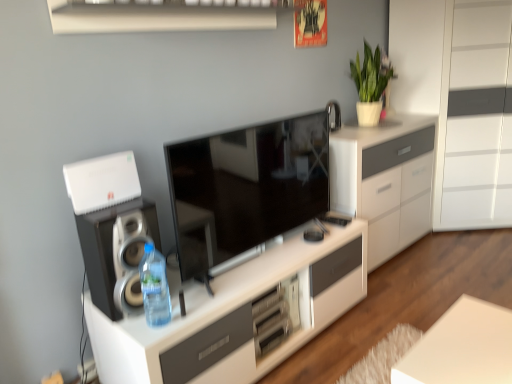
Image resolution: width=512 pixels, height=384 pixels. What are the coordinates of `white plastic router at upper left` in the screenshot? It's located at (102, 182).

The height and width of the screenshot is (384, 512). What do you see at coordinates (102, 182) in the screenshot?
I see `white plastic router at upper left` at bounding box center [102, 182].

Measure the distance between white glossy cabinet at right and camera.

A distance of 9.11 feet exists between white glossy cabinet at right and camera.

Where is `matte black speaker at left`? The width and height of the screenshot is (512, 384). matte black speaker at left is located at coordinates (117, 253).

Measure the distance between white matte plant at upper right and camera.

A distance of 2.74 meters exists between white matte plant at upper right and camera.

In order to face white glossy cabinet at center, placed as the second cabinetry when sorted from bottom to top, should I rotate leftwards or rightwards?

You should look right and rotate roughly 15.387 degrees.

Measure the distance between point (x=191, y=17) and camera.

Point (x=191, y=17) is 6.52 feet from camera.

The width and height of the screenshot is (512, 384). I want to click on white plastic router at upper left, so click(102, 182).

Can you confirm if translucent plastic bottle at lower left is positioned to the left of white glossy cabinet at center, placed as the 2th cabinetry when sorted from top to bottom?

Correct, you'll find translucent plastic bottle at lower left to the left of white glossy cabinet at center, placed as the 2th cabinetry when sorted from top to bottom.

How far apart are translucent plastic bottle at lower left and white glossy cabinet at center, which appears as the first cabinetry when ordered from the bottom?

16.52 inches.

Locate an element on the screen. bottle located above the white glossy cabinet at center, placed as the 2th cabinetry when sorted from top to bottom (from the image's perspective) is located at coordinates (154, 287).

Can you see white glossy cabinet at center, placed as the second cabinetry when sorted from bottom to top, touching translucent plastic bottle at lower left?

No, white glossy cabinet at center, placed as the second cabinetry when sorted from bottom to top, is not beside translucent plastic bottle at lower left.

Considering the relative sizes of white glossy cabinet at center, placed as the second cabinetry when sorted from bottom to top, and translucent plastic bottle at lower left in the image provided, is white glossy cabinet at center, placed as the second cabinetry when sorted from bottom to top, bigger than translucent plastic bottle at lower left?

Yes, white glossy cabinet at center, placed as the second cabinetry when sorted from bottom to top, is bigger than translucent plastic bottle at lower left.

Is white glossy cabinet at center, placed as the second cabinetry when sorted from bottom to top, to the left or to the right of translucent plastic bottle at lower left in the image?

In the image, white glossy cabinet at center, placed as the second cabinetry when sorted from bottom to top, appears on the right side of translucent plastic bottle at lower left.

Could you measure the distance between white glossy cabinet at center, positioned as the 1th cabinetry in top-to-bottom order, and translucent plastic bottle at lower left?

white glossy cabinet at center, positioned as the 1th cabinetry in top-to-bottom order, is 5.38 feet from translucent plastic bottle at lower left.

Considering the relative sizes of white glossy cabinet at center, placed as the 2th cabinetry when sorted from top to bottom, and white matte table at lower right in the image provided, is white glossy cabinet at center, placed as the 2th cabinetry when sorted from top to bottom, bigger than white matte table at lower right?

Correct, white glossy cabinet at center, placed as the 2th cabinetry when sorted from top to bottom, is larger in size than white matte table at lower right.

Who is shorter, white glossy cabinet at center, which appears as the first cabinetry when ordered from the bottom, or white matte table at lower right?

white glossy cabinet at center, which appears as the first cabinetry when ordered from the bottom, is shorter.

Is white glossy cabinet at center, placed as the 2th cabinetry when sorted from top to bottom, aimed at white matte table at lower right?

No.

How many degrees apart are the facing directions of white glossy cabinet at center, which appears as the first cabinetry when ordered from the bottom, and white matte table at lower right?

There is a 0.901-degree angle between the facing directions of white glossy cabinet at center, which appears as the first cabinetry when ordered from the bottom, and white matte table at lower right.

Is white glossy shelf at upper center placed right next to white matte plant at upper right?

No, white glossy shelf at upper center is not beside white matte plant at upper right.

Which of these two, white glossy shelf at upper center or white matte plant at upper right, is smaller?

white glossy shelf at upper center.

Is white glossy shelf at upper center positioned with its back to white matte plant at upper right?

No.

From the picture: Is white glossy shelf at upper center to the left of white matte plant at upper right from the viewer's perspective?

Yes, white glossy shelf at upper center is to the left of white matte plant at upper right.

From their relative heights in the image, would you say white glossy cabinet at center, positioned as the 1th cabinetry in top-to-bottom order, is taller or shorter than white matte table at lower right?

Clearly, white glossy cabinet at center, positioned as the 1th cabinetry in top-to-bottom order, is taller compared to white matte table at lower right.

Considering the relative sizes of white glossy cabinet at center, positioned as the 1th cabinetry in top-to-bottom order, and white matte table at lower right in the image provided, is white glossy cabinet at center, positioned as the 1th cabinetry in top-to-bottom order, thinner than white matte table at lower right?

No.

Is point (372, 204) closer or farther from the camera than point (474, 334)?

Point (372, 204) is farther from the camera than point (474, 334).

Is white glossy cabinet at center, placed as the second cabinetry when sorted from bottom to top, beside white matte table at lower right?

No, white glossy cabinet at center, placed as the second cabinetry when sorted from bottom to top, is not in contact with white matte table at lower right.

In the scene shown: Is white plastic router at upper left positioned beyond the bounds of white glossy cabinet at center, which appears as the first cabinetry when ordered from the bottom?

Yes, white plastic router at upper left is outside of white glossy cabinet at center, which appears as the first cabinetry when ordered from the bottom.

Is white plastic router at upper left taller than white glossy cabinet at center, placed as the 2th cabinetry when sorted from top to bottom?

Yes, white plastic router at upper left is taller than white glossy cabinet at center, placed as the 2th cabinetry when sorted from top to bottom.

Can you confirm if white plastic router at upper left is bigger than white glossy cabinet at center, which appears as the first cabinetry when ordered from the bottom?

Incorrect, white plastic router at upper left is not larger than white glossy cabinet at center, which appears as the first cabinetry when ordered from the bottom.

From the image's perspective, which object appears higher, white matte plant at upper right or translucent plastic bottle at lower left?

white matte plant at upper right is shown above in the image.

Is white matte plant at upper right inside or outside of translucent plastic bottle at lower left?

white matte plant at upper right is not enclosed by translucent plastic bottle at lower left.

Does white matte plant at upper right have a lesser width compared to translucent plastic bottle at lower left?

In fact, white matte plant at upper right might be wider than translucent plastic bottle at lower left.

Where is `bottle on the left of white glossy cabinet at center, which appears as the first cabinetry when ordered from the bottom`? bottle on the left of white glossy cabinet at center, which appears as the first cabinetry when ordered from the bottom is located at coordinates coord(154,287).

What are the coordinates of `cabinetry that is above the translucent plastic bottle at lower left (from the image's perspective)` in the screenshot? It's located at (385, 180).

When comparing their distances from white plastic router at upper left, does white glossy cabinet at center, positioned as the 1th cabinetry in top-to-bottom order, or white glossy shelf at upper center seem further?

white glossy cabinet at center, positioned as the 1th cabinetry in top-to-bottom order.

Looking at the image, which one is located further to translucent plastic bottle at lower left, white matte plant at upper right or white matte table at lower right?

white matte plant at upper right lies further to translucent plastic bottle at lower left than the other object.

When comparing their distances from matte black tv at center, does white glossy cabinet at center, which appears as the first cabinetry when ordered from the bottom, or translucent plastic bottle at lower left seem further?

translucent plastic bottle at lower left lies further to matte black tv at center than the other object.

From the image, which object appears to be farther from matte black tv at center, white glossy cabinet at right or white glossy shelf at upper center?

white glossy cabinet at right is further to matte black tv at center.

From the image, which object appears to be nearer to matte black tv at center, white matte table at lower right or white glossy cabinet at right?

white matte table at lower right is closer to matte black tv at center.

Estimate the real-world distances between objects in this image. Which object is further from white glossy shelf at upper center, white plastic router at upper left or white glossy cabinet at right?

white glossy cabinet at right is positioned further to the anchor white glossy shelf at upper center.

Estimate the real-world distances between objects in this image. Which object is closer to white matte plant at upper right, matte black speaker at left or white glossy cabinet at center, positioned as the 1th cabinetry in top-to-bottom order?

white glossy cabinet at center, positioned as the 1th cabinetry in top-to-bottom order, is closer to white matte plant at upper right.

From the image, which object appears to be nearer to white plastic router at upper left, matte black tv at center or white glossy shelf at upper center?

matte black tv at center is closer to white plastic router at upper left.

At what (x,y) coordinates should I click in order to perform the action: click on home appliance between white plastic router at upper left and white glossy cabinet at right. Please return your answer as a coordinate pair (x, y). This screenshot has height=384, width=512. Looking at the image, I should click on (117, 253).

Find the location of a particular element. bottle between white glossy shelf at upper center and white matte table at lower right from top to bottom is located at coordinates (154, 287).

Locate an element on the screen. shelf between translucent plastic bottle at lower left and white glossy cabinet at right from left to right is located at coordinates (163, 15).

You are a GUI agent. You are given a task and a screenshot of the screen. Output one action in this format:
    pyautogui.click(x=<x>, y=<y>)
    Task: Click on the bottle located between matte black speaker at left and white glossy cabinet at center, placed as the 2th cabinetry when sorted from top to bottom, in the left-right direction
    Image resolution: width=512 pixels, height=384 pixels.
    Given the screenshot: What is the action you would take?
    pyautogui.click(x=154, y=287)